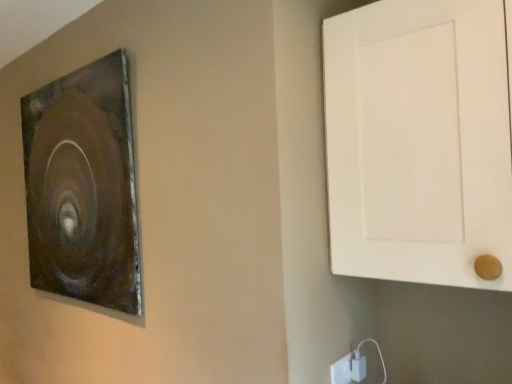
Question: Could white matte door at right be considered to be inside metallic brown picture frame at upper left?

Choices:
 (A) yes
 (B) no

Answer: (B)

Question: Can you confirm if metallic brown picture frame at upper left is positioned to the right of white matte door at right?

Choices:
 (A) yes
 (B) no

Answer: (B)

Question: Is metallic brown picture frame at upper left taller than white matte door at right?

Choices:
 (A) no
 (B) yes

Answer: (B)

Question: Can you confirm if metallic brown picture frame at upper left is smaller than white matte door at right?

Choices:
 (A) no
 (B) yes

Answer: (B)

Question: Is metallic brown picture frame at upper left placed right next to white matte door at right?

Choices:
 (A) no
 (B) yes

Answer: (A)

Question: From a real-world perspective, is metallic brown picture frame at upper left positioned under white matte door at right based on gravity?

Choices:
 (A) yes
 (B) no

Answer: (A)

Question: Can you confirm if metallic brown picture frame at upper left is wider than white plastic electric outlet at lower right?

Choices:
 (A) yes
 (B) no

Answer: (A)

Question: Considering the relative positions of metallic brown picture frame at upper left and white plastic electric outlet at lower right in the image provided, is metallic brown picture frame at upper left to the left of white plastic electric outlet at lower right from the viewer's perspective?

Choices:
 (A) yes
 (B) no

Answer: (A)

Question: Does metallic brown picture frame at upper left come behind white plastic electric outlet at lower right?

Choices:
 (A) no
 (B) yes

Answer: (B)

Question: Is white plastic electric outlet at lower right located within metallic brown picture frame at upper left?

Choices:
 (A) no
 (B) yes

Answer: (A)

Question: From a real-world perspective, is metallic brown picture frame at upper left over white plastic electric outlet at lower right?

Choices:
 (A) no
 (B) yes

Answer: (B)

Question: Could you tell me if metallic brown picture frame at upper left is facing white plastic electric outlet at lower right?

Choices:
 (A) no
 (B) yes

Answer: (A)

Question: From a real-world perspective, is white matte door at right on top of metallic brown picture frame at upper left?

Choices:
 (A) no
 (B) yes

Answer: (B)